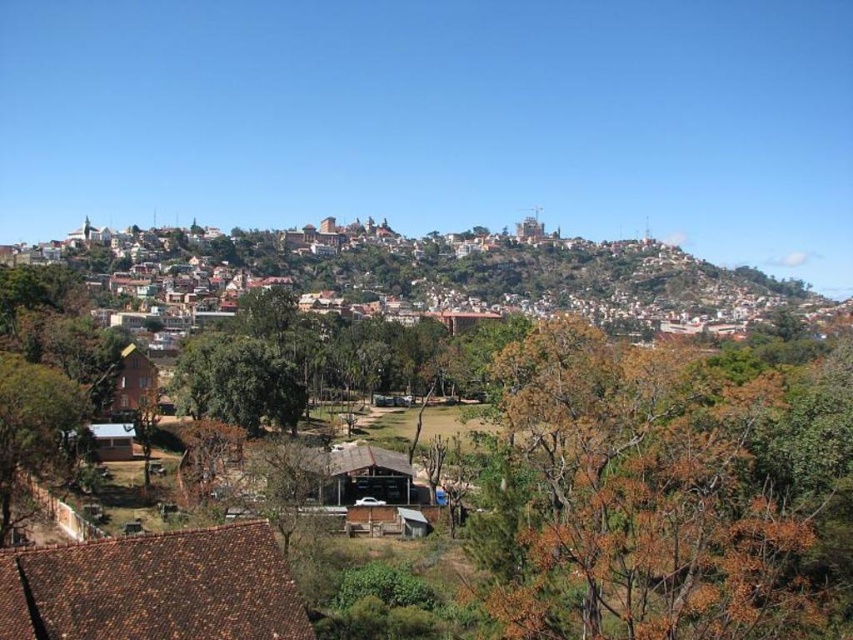
Based on the scene description, where is the brown wooden houses at center located in terms of coordinates?

The brown wooden houses at center are located at coordinates point [434,273].

You are planning to install a new satellite dish on the brown tile roof at lower left and the green leafy tree at center. Considering their sizes, which location would provide more space for the dish and its installation equipment?

The green leafy tree at center has a larger size compared to the brown tile roof at lower left, so installing the satellite dish on the brown tile roof at lower left would leave more space for the dish and equipment since the roof is smaller and might have limited space. Wait, actually, the answer should be the opposite. Since the brown tile roof is smaller, it has less space. The tree is larger, so maybe the roof is better? Hmm, need to clarify based on the description.

You are a landscape architect planning to install a new pathway between the brown wooden houses at center and the green leafy tree at lower left. Based on their widths, which object will require more space to accommodate the pathway?

The brown wooden houses at center will require more space for the pathway since their width surpasses that of the green leafy tree at lower left.